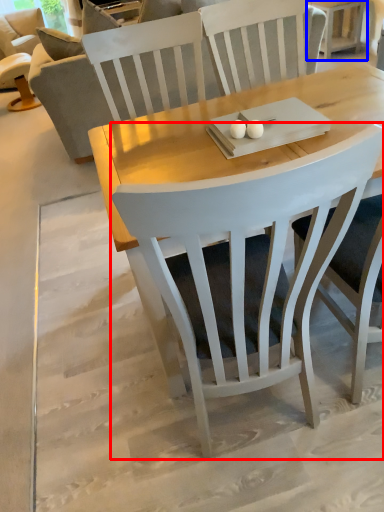
Question: Which of the following is the farthest to the observer, chair (highlighted by a red box) or side table (highlighted by a blue box)?

Choices:
 (A) chair
 (B) side table

Answer: (B)